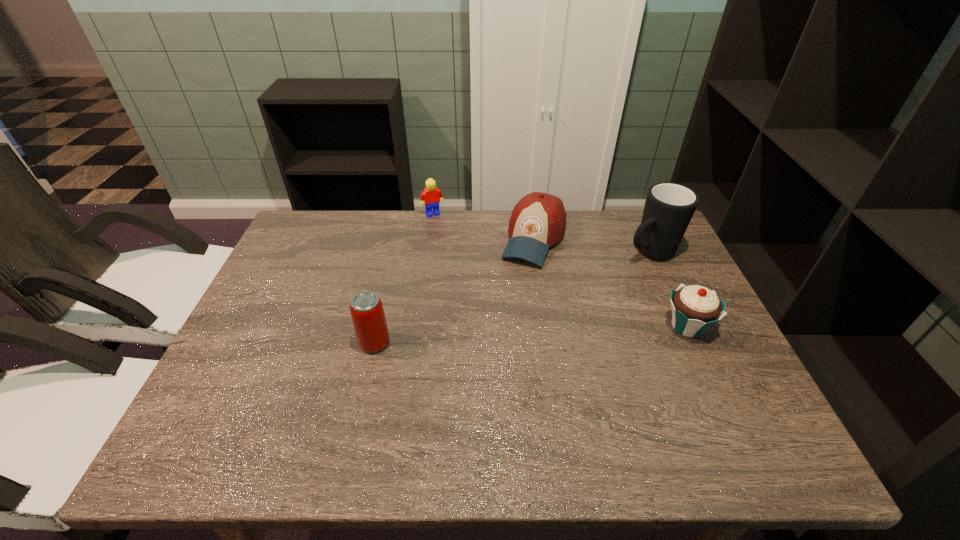
The width and height of the screenshot is (960, 540). In order to click on vacant spot on the desktop that is between the leftmost object and the cupcake and is positioned on the front-facing side of the third object from left to right in this screenshot , I will do `click(488, 337)`.

Identify the location of vacant spot on the desktop that is between the leftmost object and the cupcake and is positioned on the front-facing side of the Lego. Image resolution: width=960 pixels, height=540 pixels. (490, 337).

Where is `vacant space on the desktop that is between the leftmost object and the cupcake and is positioned on the side of the mug with the handle`? The width and height of the screenshot is (960, 540). vacant space on the desktop that is between the leftmost object and the cupcake and is positioned on the side of the mug with the handle is located at coordinates (506, 336).